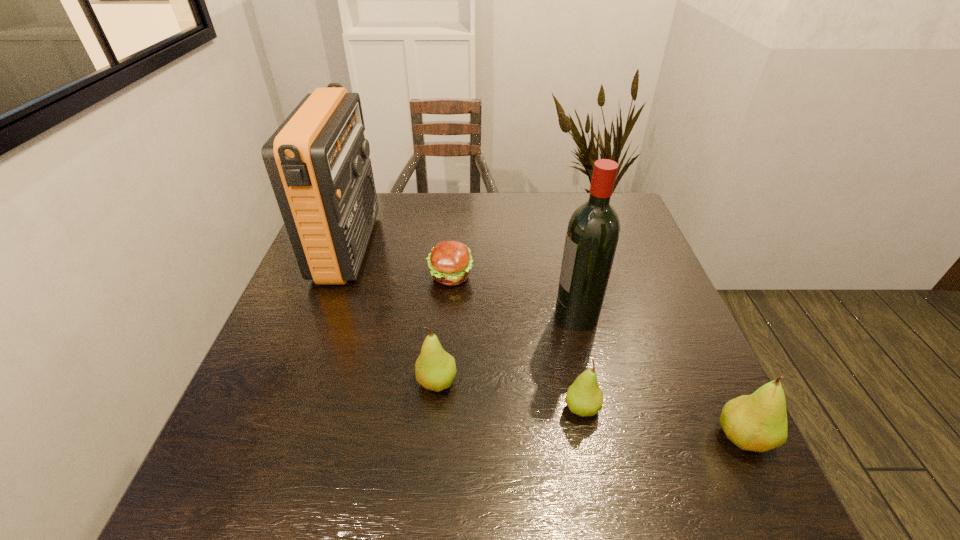
Where is `vacant point that satisfies the following two spatial constraints: 1. on the label of the wine bottle; 2. on the back side of the rightmost object`? Image resolution: width=960 pixels, height=540 pixels. vacant point that satisfies the following two spatial constraints: 1. on the label of the wine bottle; 2. on the back side of the rightmost object is located at coordinates (605, 437).

Locate an element on the screen. This screenshot has width=960, height=540. free space that satisfies the following two spatial constraints: 1. on the front-facing side of the radio receiver; 2. on the left side of the rightmost pear is located at coordinates (276, 437).

Locate an element on the screen. The image size is (960, 540). vacant space that satisfies the following two spatial constraints: 1. on the front-facing side of the rightmost object; 2. on the right side of the radio receiver is located at coordinates (276, 437).

Identify the location of vacant region that satisfies the following two spatial constraints: 1. on the front-facing side of the leftmost object; 2. on the right side of the rightmost pear. (276, 437).